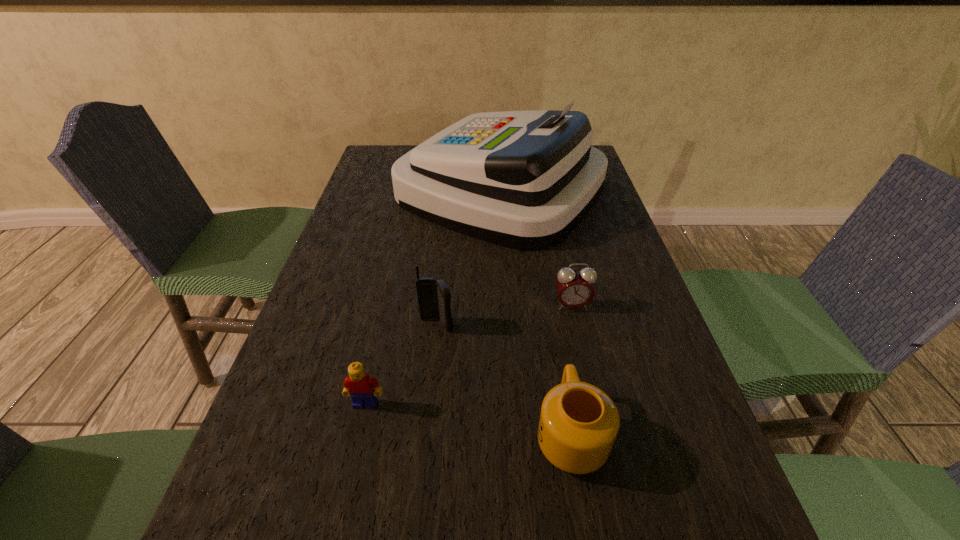
The width and height of the screenshot is (960, 540). Identify the location of object at the far right corner. (524, 180).

Image resolution: width=960 pixels, height=540 pixels. Find the location of `vacant space at the left edge of the desktop`. vacant space at the left edge of the desktop is located at coordinates (389, 235).

Identify the location of free location at the right edge. (736, 539).

Where is `free space at the far left corner`? The width and height of the screenshot is (960, 540). free space at the far left corner is located at coordinates (378, 150).

At what (x,y) coordinates should I click in order to perform the action: click on free space between the second tallest object and the alarm clock. Please return your answer as a coordinate pair (x, y). The width and height of the screenshot is (960, 540). Looking at the image, I should click on (504, 315).

Find the location of `free space between the tallest object and the third farthest object`. free space between the tallest object and the third farthest object is located at coordinates coord(468,258).

Where is `empty space that is in between the mug and the farthest object`? This screenshot has width=960, height=540. empty space that is in between the mug and the farthest object is located at coordinates (536, 312).

Where is `vacant region between the third farthest object and the Lego`? The width and height of the screenshot is (960, 540). vacant region between the third farthest object and the Lego is located at coordinates (401, 364).

This screenshot has width=960, height=540. Find the location of `empty space between the alarm clock and the third farthest object`. empty space between the alarm clock and the third farthest object is located at coordinates (504, 315).

Locate an element on the screen. Image resolution: width=960 pixels, height=540 pixels. free space between the mug and the third farthest object is located at coordinates (504, 379).